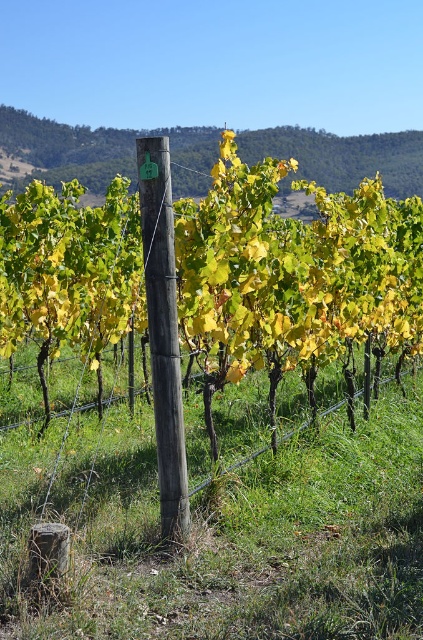
Question: Is wooden post at center below weathered wood post at center?

Choices:
 (A) no
 (B) yes

Answer: (A)

Question: Can you confirm if wooden post at center is thinner than weathered wood post at center?

Choices:
 (A) no
 (B) yes

Answer: (A)

Question: Does wooden post at center lie behind weathered wood post at center?

Choices:
 (A) yes
 (B) no

Answer: (A)

Question: Which of the following is the farthest from the observer?

Choices:
 (A) weathered wood post at center
 (B) wooden post at center

Answer: (B)